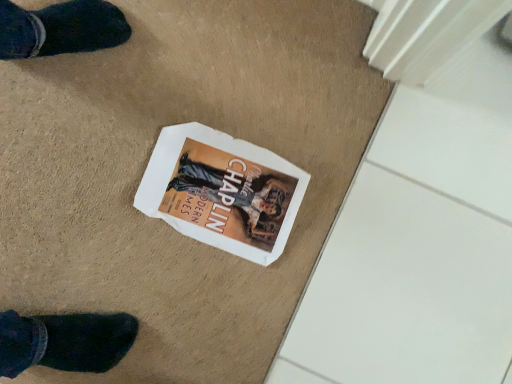
What do you see at coordinates (222, 191) in the screenshot? I see `white paper magazine at center` at bounding box center [222, 191].

This screenshot has height=384, width=512. What are the coordinates of `white paper magazine at center` in the screenshot? It's located at (222, 191).

At what (x,y) coordinates should I click in order to perform the action: click on white paper magazine at center. Please return your answer as a coordinate pair (x, y). This screenshot has width=512, height=384. Looking at the image, I should click on (222, 191).